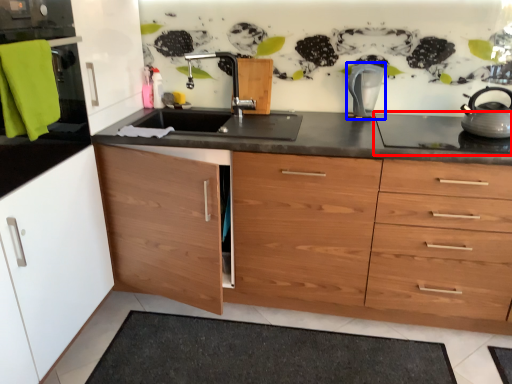
Question: Among these objects, which one is farthest to the camera, gas stove (highlighted by a red box) or kitchen appliance (highlighted by a blue box)?

Choices:
 (A) gas stove
 (B) kitchen appliance

Answer: (B)